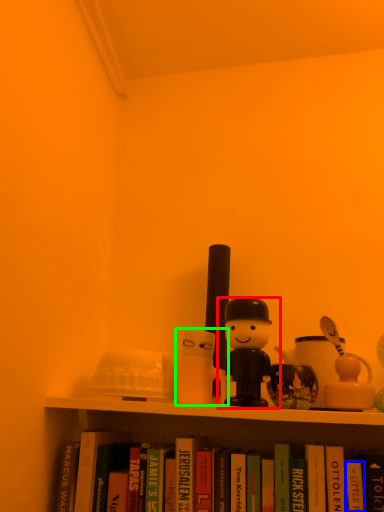
Question: Estimate the real-world distances between objects in this image. Which object is closer to toy (highlighted by a red box), paperback book (highlighted by a blue box) or toy (highlighted by a green box)?

Choices:
 (A) paperback book
 (B) toy

Answer: (B)